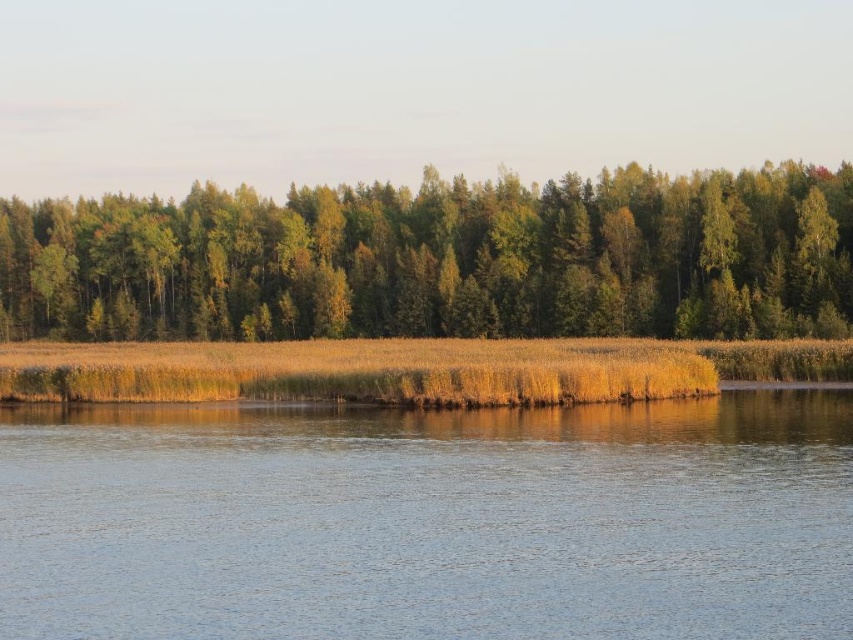
You are standing at the edge of the water in the serene landscape. You see two points marked in the image. Which point, point (x=387, y=532) or point (x=631, y=308), is closer to you?

Point (x=387, y=532) is closer to the camera than point (x=631, y=308).

You are standing at the edge of the forest and see the blue water at center and the green leafy trees at center. Which one is closer to your left side?

The green leafy trees at center are to the left of the blue water at center, so they are closer to your left side.